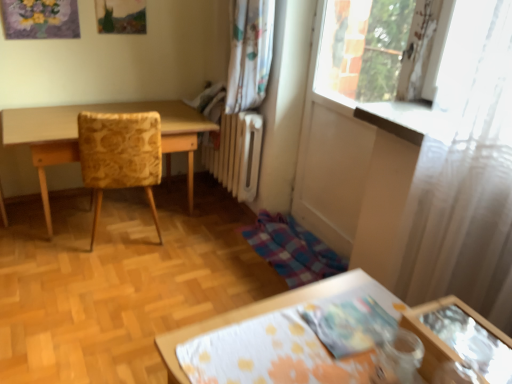
This screenshot has width=512, height=384. Identify the location of free space on the front side of light wood table at left. (96, 291).